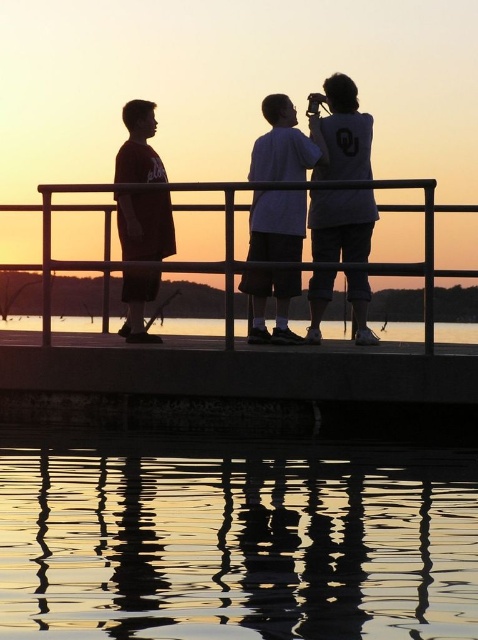
Question: Does white matte shirt at upper center appear under transparent glass water at lower center?

Choices:
 (A) no
 (B) yes

Answer: (A)

Question: Is metallic silver rail at center positioned before white matte shirt at center?

Choices:
 (A) yes
 (B) no

Answer: (A)

Question: Estimate the real-world distances between objects in this image. Which object is closer to the metallic silver rail at center?

Choices:
 (A) reflective water at lower center
 (B) transparent glass water at lower center
 (C) white matte shirt at center

Answer: (C)

Question: Which point appears farthest from the camera in this image?

Choices:
 (A) (347, 156)
 (B) (43, 259)
 (C) (177, 582)
 (D) (254, 164)

Answer: (D)

Question: Which point is closer to the camera?

Choices:
 (A) click(x=98, y=324)
 (B) click(x=424, y=307)

Answer: (B)

Question: Does metallic silver rail at center appear on the left side of white matte shirt at center?

Choices:
 (A) yes
 (B) no

Answer: (A)